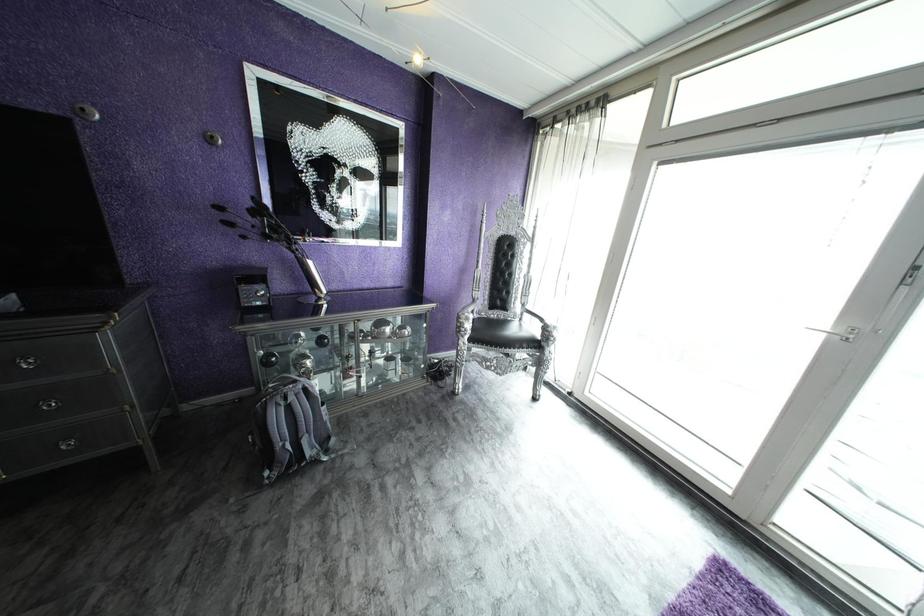
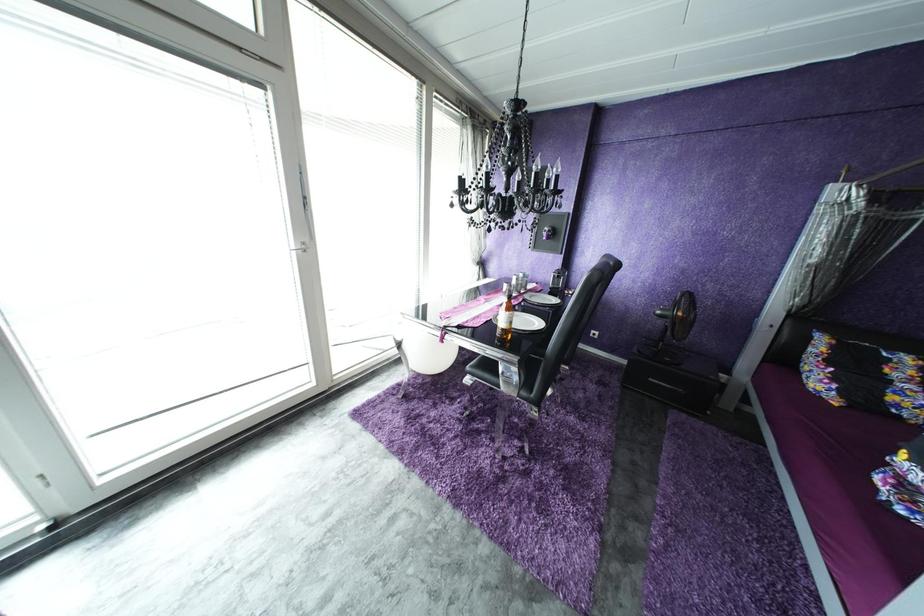
The first image is from the beginning of the video and the second image is from the end. How did the camera likely rotate when shooting the video?

The rotation direction of the camera is right-down.